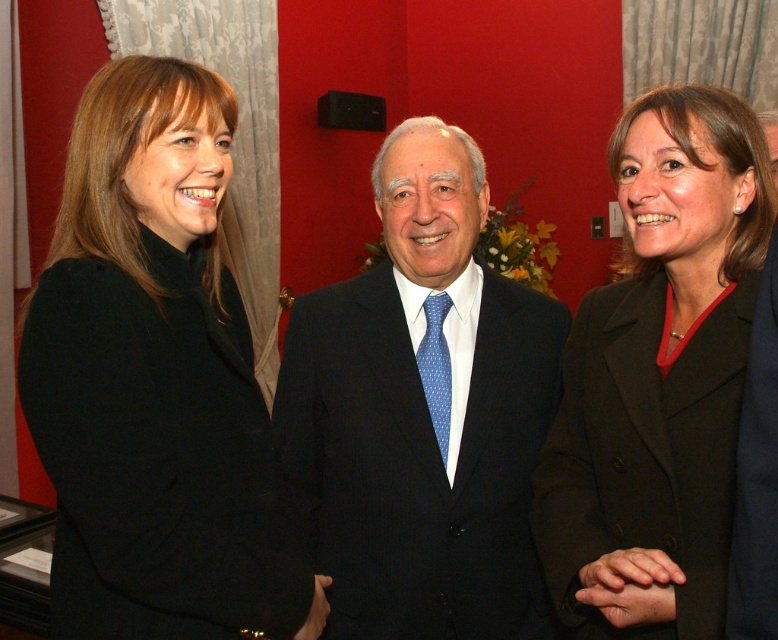
Does black woolen coat at left have a lesser width compared to matte black blazer at center?

In fact, black woolen coat at left might be wider than matte black blazer at center.

What are the coordinates of `black woolen coat at left` in the screenshot? It's located at (153, 380).

Based on the photo, who is more distant from viewer, (124, 205) or (640, 97)?

Point (640, 97)

Locate an element on the screen. The image size is (778, 640). black woolen coat at left is located at coordinates (153, 380).

Who is higher up, black silk suit at center or blue dotted silk tie at center?

blue dotted silk tie at center is higher up.

Does black silk suit at center lie in front of blue dotted silk tie at center?

Yes, black silk suit at center is in front of blue dotted silk tie at center.

Is point (773, 580) farther from viewer compared to point (435, 360)?

No, it is in front of (435, 360).

At what (x,y) coordinates should I click in order to perform the action: click on black silk suit at center. Please return your answer as a coordinate pair (x, y). The height and width of the screenshot is (640, 778). Looking at the image, I should click on (757, 474).

Between point (512, 598) and point (706, 477), which one is positioned behind?

Positioned behind is point (512, 598).

Between point (412, 458) and point (663, 433), which one is positioned in front?

Point (663, 433)

Between point (531, 426) and point (692, 605), which one is positioned behind?

Positioned behind is point (531, 426).

This screenshot has width=778, height=640. In order to click on black suit at center in this screenshot , I will do `click(421, 413)`.